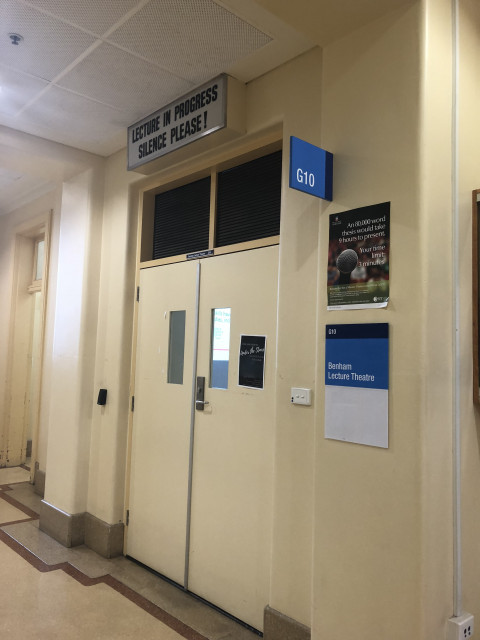
This screenshot has height=640, width=480. I want to click on door window, so click(x=218, y=360).